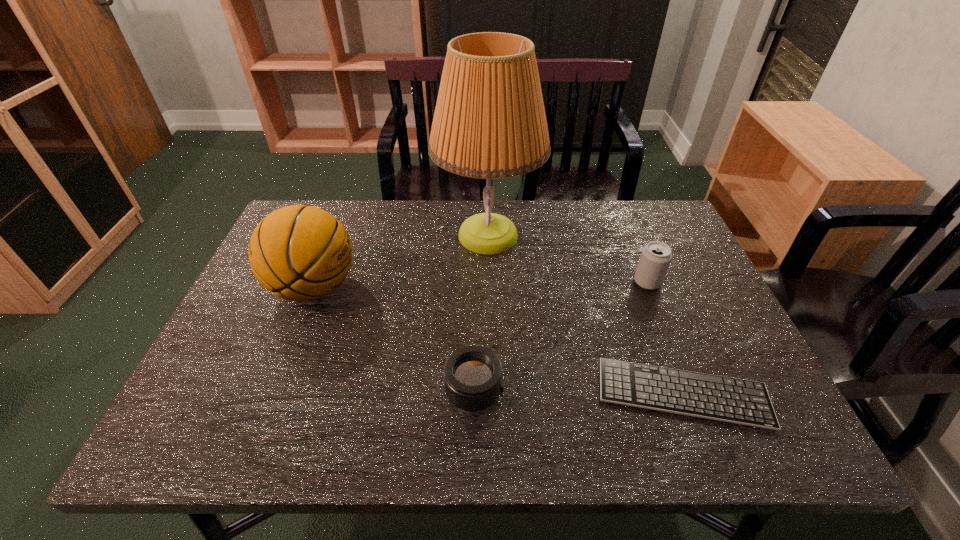
You are a GUI agent. You are given a task and a screenshot of the screen. Output one action in this format:
    pyautogui.click(x=<x>, y=<y>)
    Task: Click on the lamp
    
    Given the screenshot: What is the action you would take?
    pyautogui.click(x=489, y=122)

Locate an element on the screen. basketball is located at coordinates (300, 253).

The width and height of the screenshot is (960, 540). Find the location of `the second tallest object`. the second tallest object is located at coordinates (300, 253).

Locate an element on the screen. The width and height of the screenshot is (960, 540). the third shortest object is located at coordinates (655, 258).

The width and height of the screenshot is (960, 540). What are the coordinates of `telephoto lens` in the screenshot? It's located at (473, 375).

This screenshot has height=540, width=960. Find the location of `the shortest object`. the shortest object is located at coordinates (740, 401).

This screenshot has width=960, height=540. I want to click on vacant area situated 0.330m on the side of the lamp near the pull switch, so click(324, 235).

Locate an element on the screen. The height and width of the screenshot is (540, 960). vacant position located 0.070m on the side of the lamp near the pull switch is located at coordinates (412, 235).

At what (x,y) coordinates should I click in order to perform the action: click on free point located 0.050m on the side of the lamp near the pull switch. Please return your answer as a coordinate pair (x, y). Looking at the image, I should click on (419, 235).

The image size is (960, 540). I want to click on vacant space situated 0.100m on the surface of the second tallest object near the brand logo, so click(398, 288).